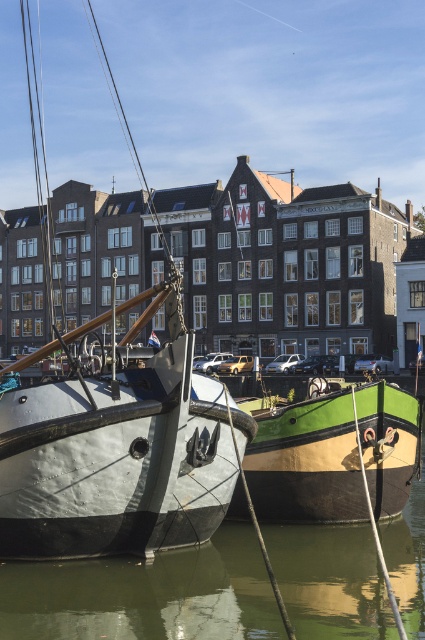
You are a photographer planning to take a photo of the matte black boat at left and the green rubber boat at center from above. Which boat will appear taller in your photo?

The matte black boat at left will appear taller in the photo because it has a greater height compared to the green rubber boat at center.

You are an observer standing on the dock looking at the two boats. Which boat, the green rubber boat at center or the green matte boat at center, would you estimate to have a bigger capacity for passengers?

The green rubber boat at center has a larger size compared to the green matte boat at center, so it likely has a bigger capacity for passengers.

You are a dock worker who needs to move a new cargo container that is 10 meters long. You have to choose between the matte black boat at left and the green matte boat at center. Which boat can accommodate the container based on their widths?

The matte black boat at left has a greater width than the green matte boat at center, so it can accommodate the 10 meters long cargo container better.